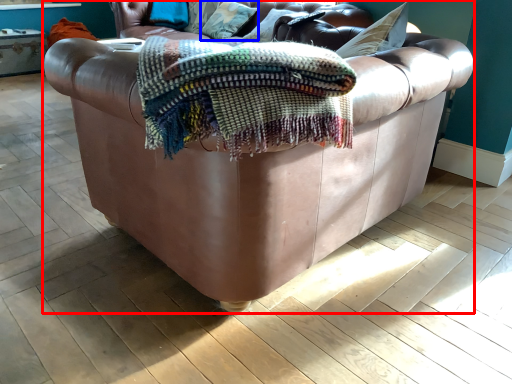
Question: Among these objects, which one is farthest to the camera, studio couch (highlighted by a red box) or pillow (highlighted by a blue box)?

Choices:
 (A) studio couch
 (B) pillow

Answer: (B)